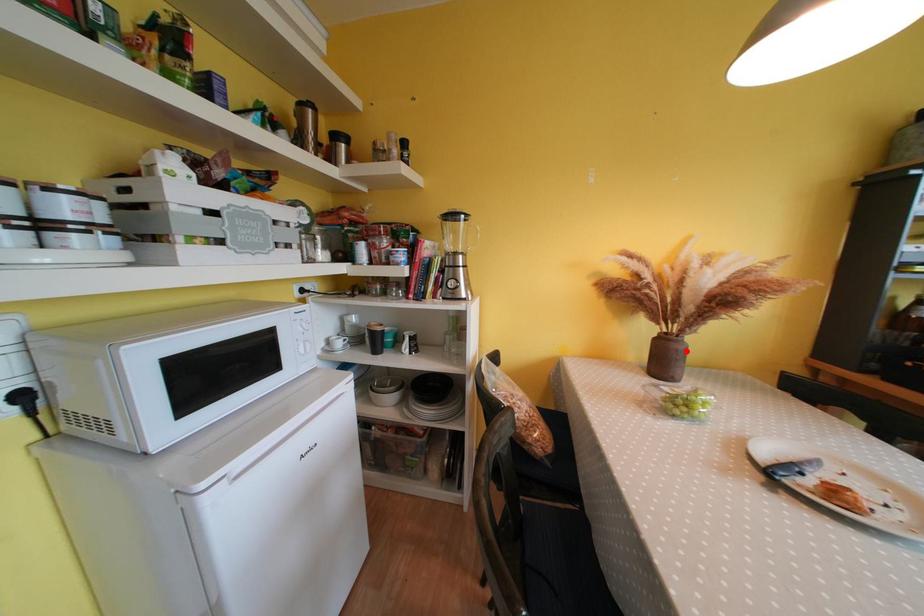
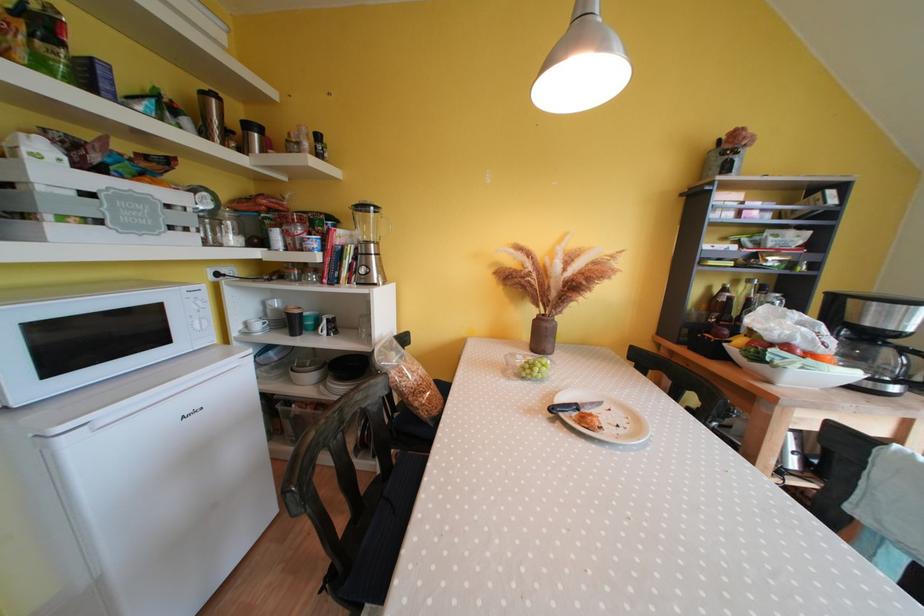
The point at the highlighted location is marked in the first image. Where is the corresponding point in the second image?

(554, 330)